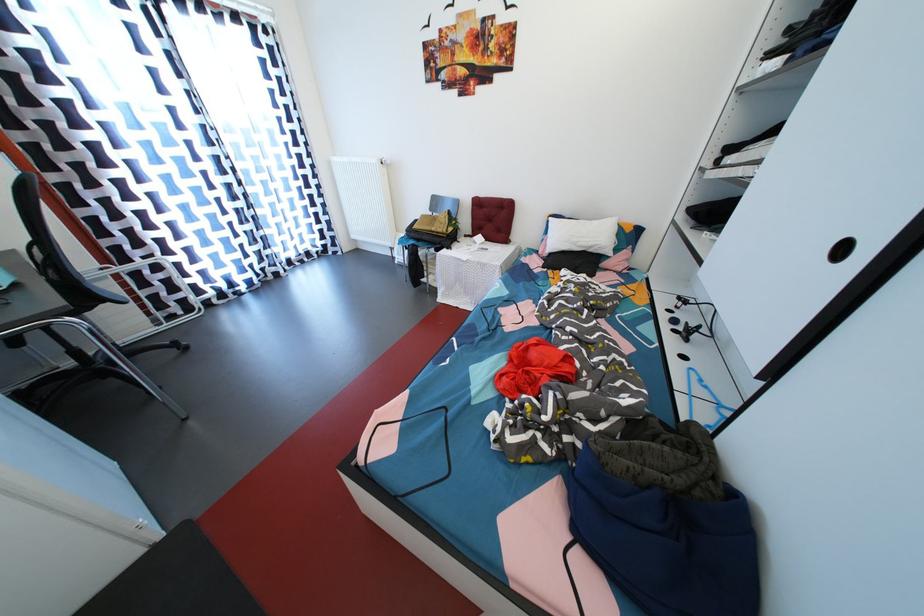
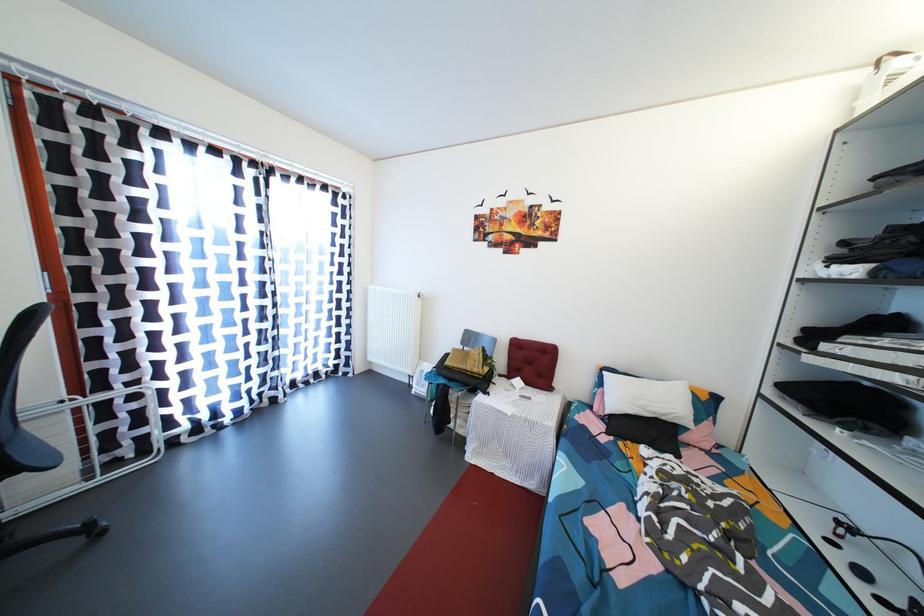
Question: The first image is from the beginning of the video and the second image is from the end. How did the camera likely rotate when shooting the video?

Choices:
 (A) Left
 (B) Right
 (C) Up
 (D) Down

Answer: (C)